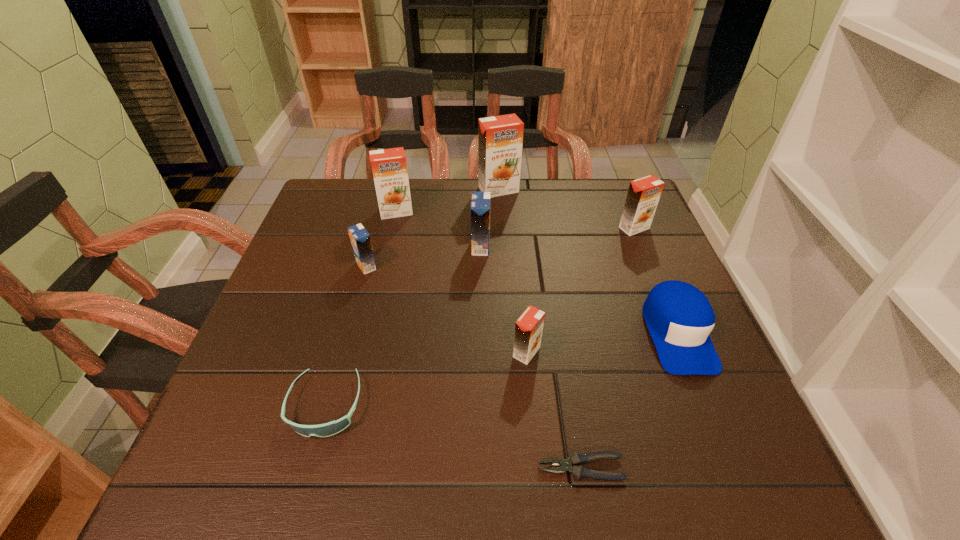
Locate an element on the screen. the tallest object is located at coordinates (500, 138).

What are the coordinates of `the tallest orange juice` in the screenshot? It's located at (500, 138).

Find the location of a particular element. The height and width of the screenshot is (540, 960). the eighth nearest object is located at coordinates (389, 167).

Image resolution: width=960 pixels, height=540 pixels. Identify the location of the second farthest orange orange juice. pos(389,167).

Identify the location of the sixth nearest object. The height and width of the screenshot is (540, 960). (480, 202).

At what (x,y) coordinates should I click in order to perform the action: click on the bigger blue orange_juice. Please return your answer as a coordinate pair (x, y). The width and height of the screenshot is (960, 540). Looking at the image, I should click on (480, 202).

At what (x,y) coordinates should I click in order to perform the action: click on the second smallest orange orange juice. Please return your answer as a coordinate pair (x, y). Image resolution: width=960 pixels, height=540 pixels. Looking at the image, I should click on (643, 195).

This screenshot has height=540, width=960. Identify the location of the second nearest orange orange juice. (643, 195).

The image size is (960, 540). Find the location of `the smaller blue orange_juice`. the smaller blue orange_juice is located at coordinates (360, 239).

You are a GUI agent. You are given a task and a screenshot of the screen. Output one action in this format:
    pyautogui.click(x=<x>, y=<y>)
    Task: Click on the fifth farthest object
    The width and height of the screenshot is (960, 540).
    Given the screenshot: What is the action you would take?
    pyautogui.click(x=360, y=239)